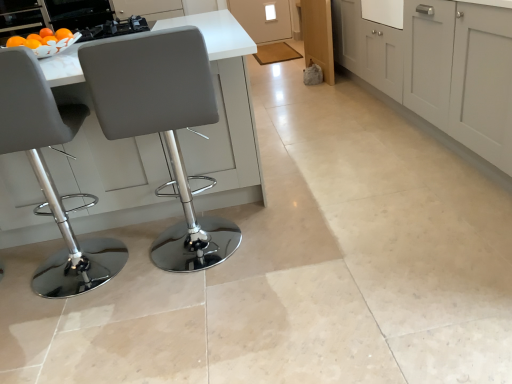
At what (x,y) coordinates should I click in order to perform the action: click on matte gray cabinets at center, arranged as the 1th cabinetry when viewed from the right. Please return your answer as a coordinate pair (x, y). Looking at the image, I should click on (438, 66).

Describe the element at coordinates (263, 18) in the screenshot. Image resolution: width=512 pixels, height=384 pixels. I see `white matte cabinet at upper center, arranged as the second cabinetry when viewed from the right` at that location.

What do you see at coordinates (78, 13) in the screenshot?
I see `metallic black stove at upper left` at bounding box center [78, 13].

The width and height of the screenshot is (512, 384). Find the location of `matte gray stool at left, arranged as the 1th chair when viewed from the left`. matte gray stool at left, arranged as the 1th chair when viewed from the left is located at coordinates (50, 175).

In the image, is matte gray cabinets at center, arranged as the 1th cabinetry when viewed from the right, on the left side or the right side of matte gray stool at left, arranged as the 1th chair when viewed from the left?

Based on their positions, matte gray cabinets at center, arranged as the 1th cabinetry when viewed from the right, is located to the right of matte gray stool at left, arranged as the 1th chair when viewed from the left.

Is there a large distance between matte gray cabinets at center, marked as the 2th cabinetry in a back-to-front arrangement, and matte gray stool at left, arranged as the 1th chair when viewed from the left?

Yes, matte gray cabinets at center, marked as the 2th cabinetry in a back-to-front arrangement, and matte gray stool at left, arranged as the 1th chair when viewed from the left, are quite far apart.

From the image's perspective, does matte gray cabinets at center, arranged as the 1th cabinetry when viewed from the right, appear lower than matte gray stool at left, arranged as the 1th chair when viewed from the left?

No, from the image's perspective, matte gray cabinets at center, arranged as the 1th cabinetry when viewed from the right, is not beneath matte gray stool at left, arranged as the 1th chair when viewed from the left.

Which of these two, white matte cabinet at upper center, which is the first cabinetry in back-to-front order, or matte gray cabinets at center, which appears as the second cabinetry when viewed from the top, is wider?

With larger width is matte gray cabinets at center, which appears as the second cabinetry when viewed from the top.

Considering the positions of point (291, 26) and point (342, 11), is point (291, 26) closer or farther from the camera than point (342, 11)?

Point (291, 26) is farther from the camera than point (342, 11).

Is white matte cabinet at upper center, the first cabinetry when ordered from left to right, facing away from matte gray cabinets at center, arranged as the 1th cabinetry when viewed from the right?

No, matte gray cabinets at center, arranged as the 1th cabinetry when viewed from the right, is not at the back of white matte cabinet at upper center, the first cabinetry when ordered from left to right.

Is white matte cabinet at upper center, the first cabinetry when ordered from left to right, bigger than metallic black stove at upper left?

Correct, white matte cabinet at upper center, the first cabinetry when ordered from left to right, is larger in size than metallic black stove at upper left.

Does white matte cabinet at upper center, the first cabinetry when ordered from left to right, have a lesser width compared to metallic black stove at upper left?

Yes.

Is white matte cabinet at upper center, which is the first cabinetry in back-to-front order, next to metallic black stove at upper left?

white matte cabinet at upper center, which is the first cabinetry in back-to-front order, and metallic black stove at upper left are clearly separated.

Which object is positioned more to the right, white matte cabinet at upper center, which is the first cabinetry in back-to-front order, or metallic black stove at upper left?

white matte cabinet at upper center, which is the first cabinetry in back-to-front order.

From a real-world perspective, is matte gray stool at left, the second chair from the right, positioned above or below metallic black stove at upper left?

In terms of real-world spatial position, matte gray stool at left, the second chair from the right, is below metallic black stove at upper left.

Can you confirm if matte gray stool at left, arranged as the 1th chair when viewed from the left, is wider than metallic black stove at upper left?

Indeed, matte gray stool at left, arranged as the 1th chair when viewed from the left, has a greater width compared to metallic black stove at upper left.

From the image's perspective, is matte gray stool at left, the second chair from the right, beneath metallic black stove at upper left?

Yes, from the image's perspective, matte gray stool at left, the second chair from the right, is beneath metallic black stove at upper left.

Considering the sizes of objects metallic black stove at upper left and matte gray stool at left, the second chair from the right, in the image provided, who is wider, metallic black stove at upper left or matte gray stool at left, the second chair from the right,?

matte gray stool at left, the second chair from the right.

Which object is further away from the camera, metallic black stove at upper left or matte gray stool at left, arranged as the 1th chair when viewed from the left?

metallic black stove at upper left is behind.

Find the location of `the 1st chair positioned below the metallic black stove at upper left (from a real-world perspective)`. the 1st chair positioned below the metallic black stove at upper left (from a real-world perspective) is located at coordinates (50, 175).

Can we say matte gray chair at left, the second chair in the left-to-right sequence, lies outside white matte cabinet at upper center, the first cabinetry when ordered from left to right?

matte gray chair at left, the second chair in the left-to-right sequence, is positioned outside white matte cabinet at upper center, the first cabinetry when ordered from left to right.

From the image's perspective, between matte gray chair at left, the second chair in the left-to-right sequence, and white matte cabinet at upper center, which ranks as the 2th cabinetry in bottom-to-top order, who is located below?

matte gray chair at left, the second chair in the left-to-right sequence, appears lower in the image.

Considering the sizes of matte gray chair at left, which is the first chair in right-to-left order, and white matte cabinet at upper center, arranged as the second cabinetry when viewed from the right, in the image, is matte gray chair at left, which is the first chair in right-to-left order, taller or shorter than white matte cabinet at upper center, arranged as the second cabinetry when viewed from the right,?

matte gray chair at left, which is the first chair in right-to-left order, is taller than white matte cabinet at upper center, arranged as the second cabinetry when viewed from the right.

Identify the location of chair that is the 1st one above the white matte cabinet at upper center, which ranks as the 2th cabinetry in bottom-to-top order (from a real-world perspective). (163, 126).

Between matte gray chair at left, which is the first chair in right-to-left order, and metallic black stove at upper left, which one has smaller width?

metallic black stove at upper left is thinner.

From a real-world perspective, which object stands above the other?

metallic black stove at upper left is physically above.

Can we say matte gray chair at left, the second chair in the left-to-right sequence, lies outside metallic black stove at upper left?

Absolutely, matte gray chair at left, the second chair in the left-to-right sequence, is external to metallic black stove at upper left.

Who is taller, matte gray chair at left, which is the first chair in right-to-left order, or metallic black stove at upper left?

Standing taller between the two is matte gray chair at left, which is the first chair in right-to-left order.

This screenshot has width=512, height=384. In order to click on the 1st cabinetry behind the matte gray stool at left, the second chair from the right in this screenshot , I will do tap(438, 66).

You are a GUI agent. You are given a task and a screenshot of the screen. Output one action in this format:
    pyautogui.click(x=<x>, y=<y>)
    Task: Click on the cabinetry in front of the white matte cabinet at upper center, which is the first cabinetry in back-to-front order
    Image resolution: width=512 pixels, height=384 pixels.
    Given the screenshot: What is the action you would take?
    pyautogui.click(x=438, y=66)

Based on the photo, based on their spatial positions, is matte gray chair at left, which is the first chair in right-to-left order, or matte gray cabinets at center, which is the second cabinetry from left to right, further from metallic black stove at upper left?

matte gray cabinets at center, which is the second cabinetry from left to right, is further to metallic black stove at upper left.

Which object lies nearer to the anchor point matte gray chair at left, the second chair in the left-to-right sequence, metallic black stove at upper left or white matte cabinet at upper center, which ranks as the 2th cabinetry in bottom-to-top order?

metallic black stove at upper left is positioned closer to the anchor matte gray chair at left, the second chair in the left-to-right sequence.

When comparing their distances from white matte cabinet at upper center, which is the first cabinetry in back-to-front order, does matte gray chair at left, which is the first chair in right-to-left order, or matte gray cabinets at center, arranged as the 1th cabinetry when viewed from the right, seem closer?

Based on the image, matte gray cabinets at center, arranged as the 1th cabinetry when viewed from the right, appears to be nearer to white matte cabinet at upper center, which is the first cabinetry in back-to-front order.

Looking at the image, which one is located closer to matte gray chair at left, the second chair in the left-to-right sequence, white matte cabinet at upper center, which ranks as the 2th cabinetry in bottom-to-top order, or metallic black stove at upper left?

metallic black stove at upper left is positioned closer to the anchor matte gray chair at left, the second chair in the left-to-right sequence.

Based on their spatial positions, is matte gray cabinets at center, arranged as the 1th cabinetry when viewed from the right, or matte gray stool at left, arranged as the 1th chair when viewed from the left, closer to matte gray chair at left, the second chair in the left-to-right sequence?

matte gray stool at left, arranged as the 1th chair when viewed from the left, is closer to matte gray chair at left, the second chair in the left-to-right sequence.

Based on their spatial positions, is metallic black stove at upper left or matte gray chair at left, which is the first chair in right-to-left order, closer to white matte cabinet at upper center, which ranks as the 2th cabinetry in bottom-to-top order?

metallic black stove at upper left lies closer to white matte cabinet at upper center, which ranks as the 2th cabinetry in bottom-to-top order, than the other object.

Which object lies nearer to the anchor point matte gray stool at left, the second chair from the right, white matte cabinet at upper center, arranged as the second cabinetry when viewed from the right, or metallic black stove at upper left?

metallic black stove at upper left.

When comparing their distances from metallic black stove at upper left, does matte gray stool at left, the second chair from the right, or white matte cabinet at upper center, which ranks as the 2th cabinetry in bottom-to-top order, seem further?

The object further to metallic black stove at upper left is white matte cabinet at upper center, which ranks as the 2th cabinetry in bottom-to-top order.

This screenshot has height=384, width=512. What are the coordinates of `chair between matte gray stool at left, the second chair from the right, and metallic black stove at upper left in the front-back direction` in the screenshot? It's located at (163, 126).

Where is `appliance between matte gray cabinets at center, arranged as the 1th cabinetry when viewed from the right, and white matte cabinet at upper center, which is the first cabinetry in back-to-front order, in the front-back direction`? The height and width of the screenshot is (384, 512). appliance between matte gray cabinets at center, arranged as the 1th cabinetry when viewed from the right, and white matte cabinet at upper center, which is the first cabinetry in back-to-front order, in the front-back direction is located at coordinates (78, 13).

In order to click on chair between matte gray stool at left, arranged as the 1th chair when viewed from the left, and matte gray cabinets at center, the 1th cabinetry ordered from the bottom, from left to right in this screenshot , I will do `click(163, 126)`.

At what (x,y) coordinates should I click in order to perform the action: click on appliance between matte gray chair at left, which is the first chair in right-to-left order, and white matte cabinet at upper center, acting as the first cabinetry starting from the top, from front to back. Please return your answer as a coordinate pair (x, y). Looking at the image, I should click on (78, 13).